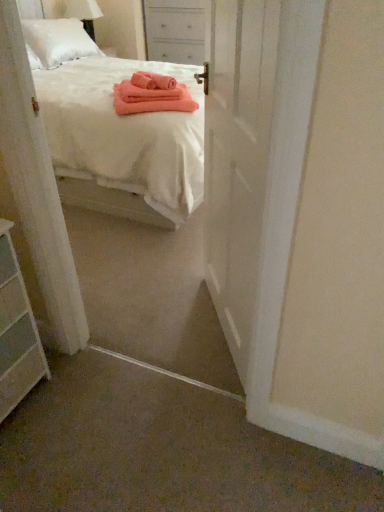
Question: From a real-world perspective, is white glossy door at center under white cotton bed at center?

Choices:
 (A) no
 (B) yes

Answer: (A)

Question: Is white glossy door at center at the left side of white cotton bed at center?

Choices:
 (A) yes
 (B) no

Answer: (B)

Question: Is the position of white glossy door at center more distant than that of white cotton bed at center?

Choices:
 (A) no
 (B) yes

Answer: (A)

Question: Is white glossy door at center turned away from white cotton bed at center?

Choices:
 (A) no
 (B) yes

Answer: (A)

Question: Could you tell me if white glossy door at center is facing white cotton bed at center?

Choices:
 (A) no
 (B) yes

Answer: (A)

Question: Does white glossy door at center appear on the right side of white cotton bed at center?

Choices:
 (A) yes
 (B) no

Answer: (A)

Question: From a real-world perspective, is white painted wood nightstand at upper center below white matte chest of drawers at lower left?

Choices:
 (A) yes
 (B) no

Answer: (B)

Question: Could you tell me if white painted wood nightstand at upper center is facing white matte chest of drawers at lower left?

Choices:
 (A) no
 (B) yes

Answer: (B)

Question: Is white painted wood nightstand at upper center thinner than white matte chest of drawers at lower left?

Choices:
 (A) yes
 (B) no

Answer: (B)

Question: From the image's perspective, is white painted wood nightstand at upper center on white matte chest of drawers at lower left?

Choices:
 (A) yes
 (B) no

Answer: (A)

Question: From the image's perspective, is white painted wood nightstand at upper center under white matte chest of drawers at lower left?

Choices:
 (A) yes
 (B) no

Answer: (B)

Question: Is the depth of white painted wood nightstand at upper center less than that of white matte chest of drawers at lower left?

Choices:
 (A) no
 (B) yes

Answer: (A)

Question: Can you confirm if white cotton bed at center is positioned to the right of white painted wood nightstand at upper center?

Choices:
 (A) no
 (B) yes

Answer: (A)